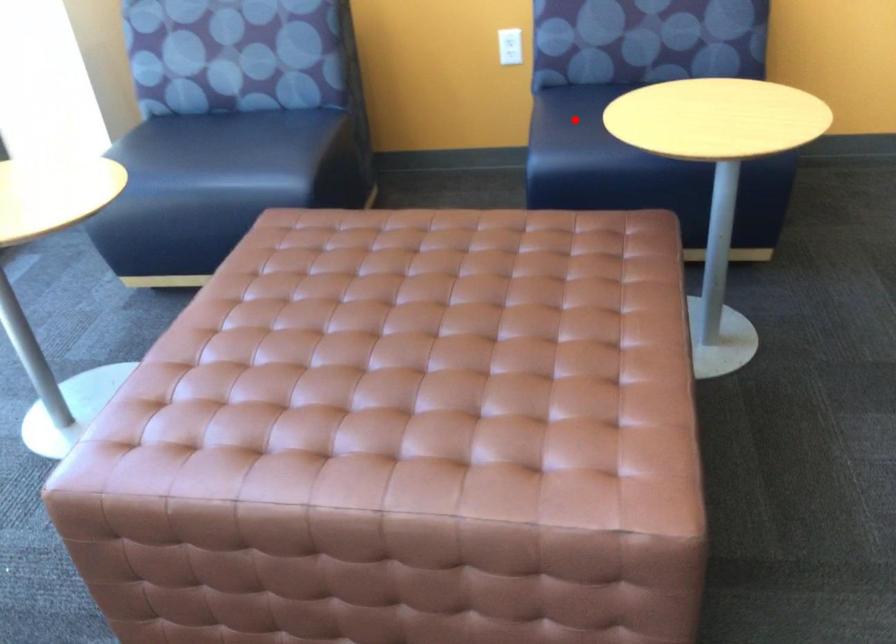
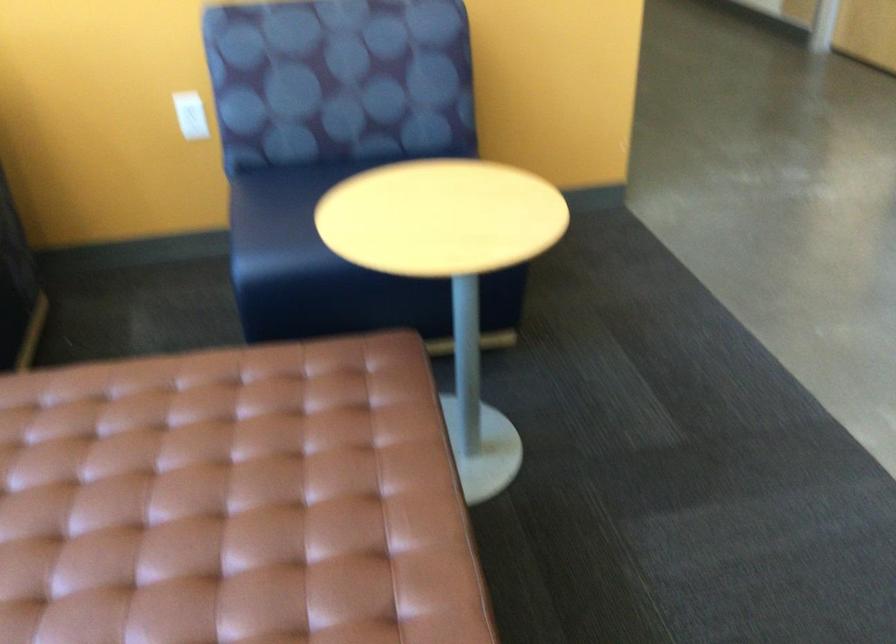
Locate, in the second image, the point that corresponds to the highlighted location in the first image.

(282, 210)